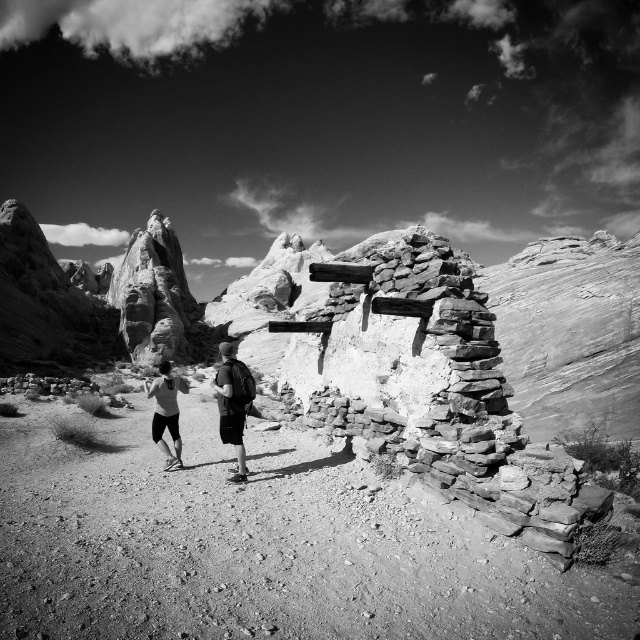
Which is in front, point (243, 387) or point (163, 449)?

Point (243, 387) is in front.

What do you see at coordinates (234, 403) in the screenshot?
I see `dark gray backpack at center` at bounding box center [234, 403].

Find the location of a particular element. Image resolution: width=640 pixels, height=640 pixels. dark gray backpack at center is located at coordinates (234, 403).

Where is `dark gray backpack at center`? The width and height of the screenshot is (640, 640). dark gray backpack at center is located at coordinates (234, 403).

Can you confirm if matte black backpacks at center is positioned below matte black shorts at center?

Correct, matte black backpacks at center is located below matte black shorts at center.

Which is more to the right, matte black backpacks at center or matte black shorts at center?

From the viewer's perspective, matte black backpacks at center appears more on the right side.

Who is more forward, [164,444] or [180,449]?

Point [180,449]

Identify the location of matte black backpacks at center. (232, 403).

Is matte black backpacks at center positioned behind dark gray backpack at center?

Yes, it is behind dark gray backpack at center.

Can you confirm if matte black backpacks at center is positioned below dark gray backpack at center?

Answer: Yes, matte black backpacks at center is below dark gray backpack at center.

Is point (170, 401) farther from viewer compared to point (220, 419)?

That is True.

Locate an element on the screen. This screenshot has height=640, width=640. matte black backpacks at center is located at coordinates (232, 403).